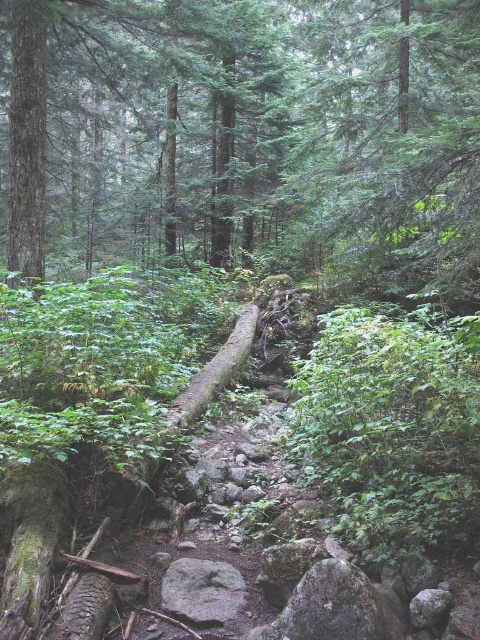
You are a hiker who wants to take a photo of the gray rough rock at lower center without the green leafy tree at center blocking the view. Can you stand on the path and still see the rock clearly?

The green leafy tree at center is taller than the gray rough rock at lower center, so standing on the path might still allow you to see the rock as long as you position yourself where the tree doesn

You are standing at the origin point in the forest scene. The origin is at the bottom left corner of the image. Where is the green leafy tree at center located in 2D coordinates?

The green leafy tree at center is located at the 2D coordinates of point (x=253, y=131).

You are a hiker standing on the rocky path in the forest. You want to place your backpack on a specific location. Where exactly is the gray rough rock at lower center located in the scene?

The gray rough rock at lower center is located at point (337, 605).